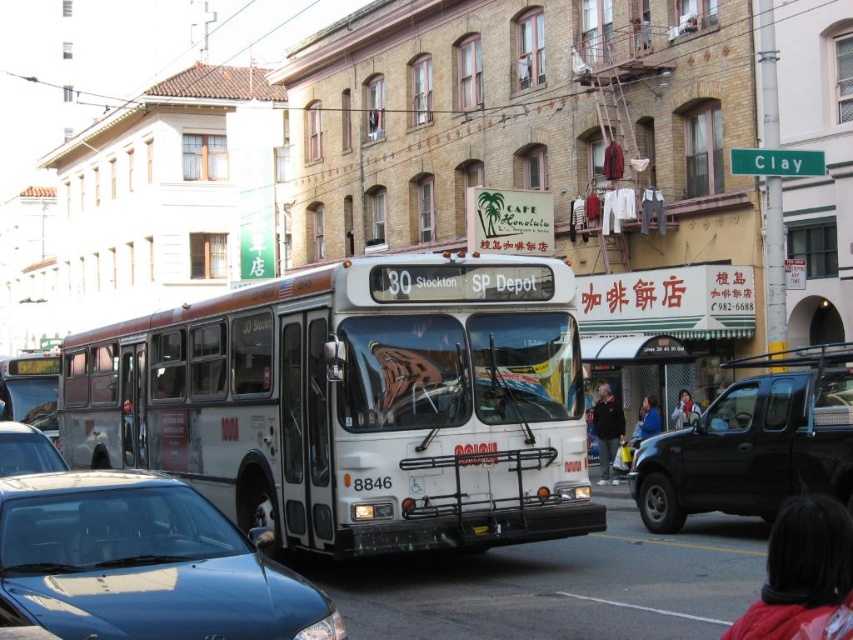
Is satin blue sedan at center thinner than black matte truck at center?

No.

Identify the location of satin blue sedan at center. This screenshot has width=853, height=640. (143, 563).

Between white matte bus at center and black plastic license plate at center, which one has less height?

black plastic license plate at center

Between white matte bus at center and black plastic license plate at center, which one has more height?

Standing taller between the two is white matte bus at center.

Locate an element on the screen. This screenshot has width=853, height=640. white matte bus at center is located at coordinates (354, 403).

I want to click on white matte bus at center, so click(x=354, y=403).

Who is positioned more to the left, dark gray jacket at center or matte black jacket at center?

dark gray jacket at center

Which is in front, point (614, 404) or point (685, 416)?

Point (614, 404) is more forward.

What do you see at coordinates (606, 428) in the screenshot? The height and width of the screenshot is (640, 853). I see `dark gray jacket at center` at bounding box center [606, 428].

Identify the location of dark gray jacket at center. The height and width of the screenshot is (640, 853). (606, 428).